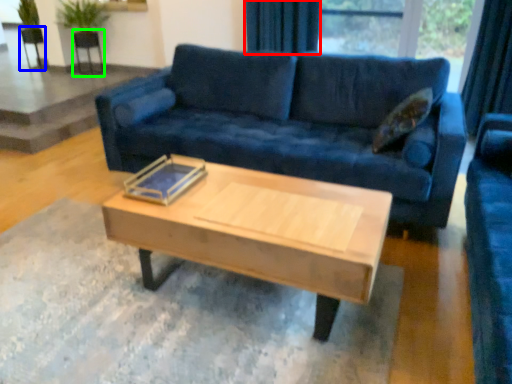
Question: Which object is the closest to the curtain (highlighted by a red box)? Choose among these: armchair (highlighted by a blue box) or armchair (highlighted by a green box).

Choices:
 (A) armchair
 (B) armchair

Answer: (B)